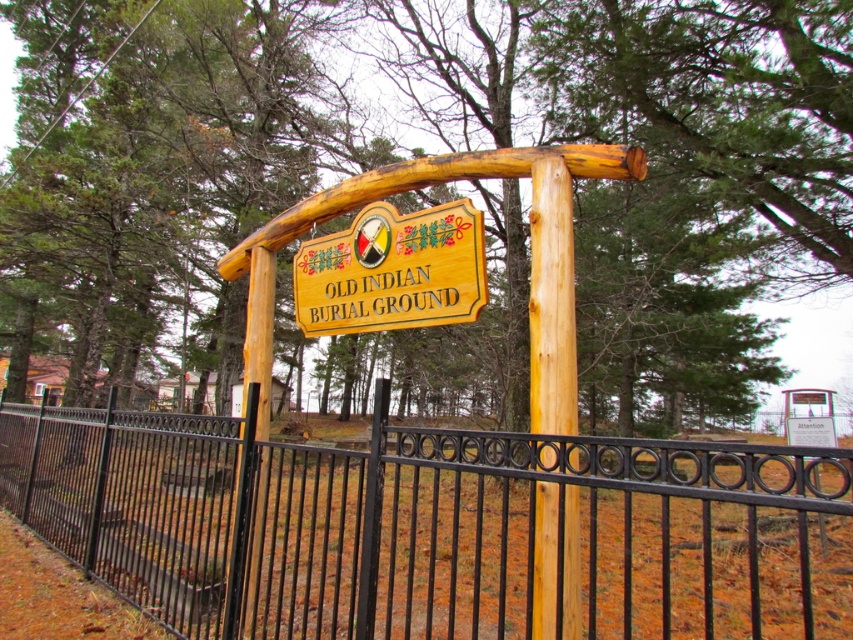
From the picture: You are standing in front of the rustic wooden sign that says Old Indian Burial Ground. There is a point marked at coordinate (436, 529). What object is located at that point?

The point at coordinate (436, 529) indicates the location of the black wrought iron fence at center.

Based on the photo, you are standing at the entrance of the burial ground and want to place a new decorative stone at the same location as the brown wood tree at center. According to the coordinates provided, where should you place the stone?

The brown wood tree at center is located at coordinates point (660,168), so you should place the stone at that exact position.

You are standing in front of the old Indian burial ground and notice a brown wood tree at center and a wooden sign at center. Which object is closer to you?

The brown wood tree at center is positioned over the wooden sign at center, so the brown wood tree at center is closer to you.